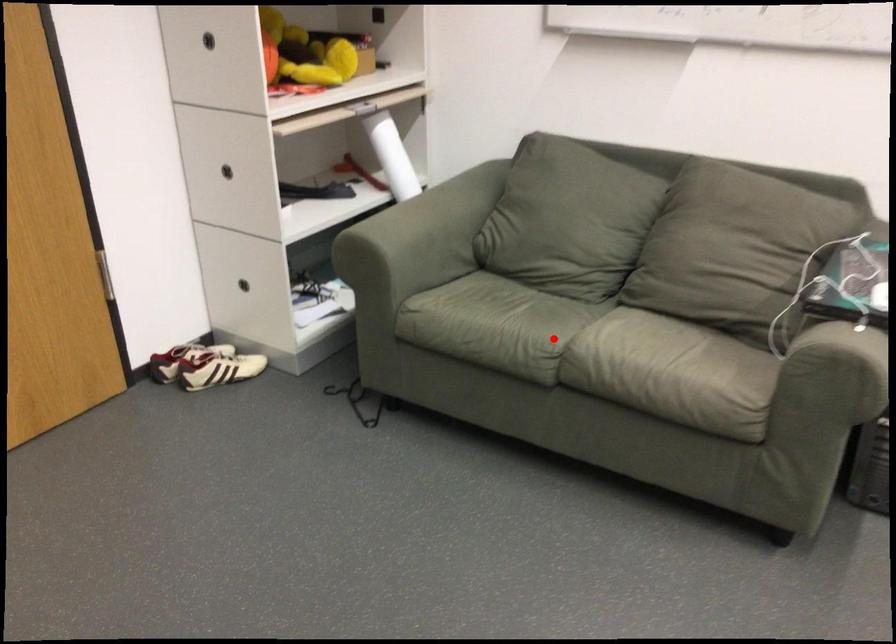
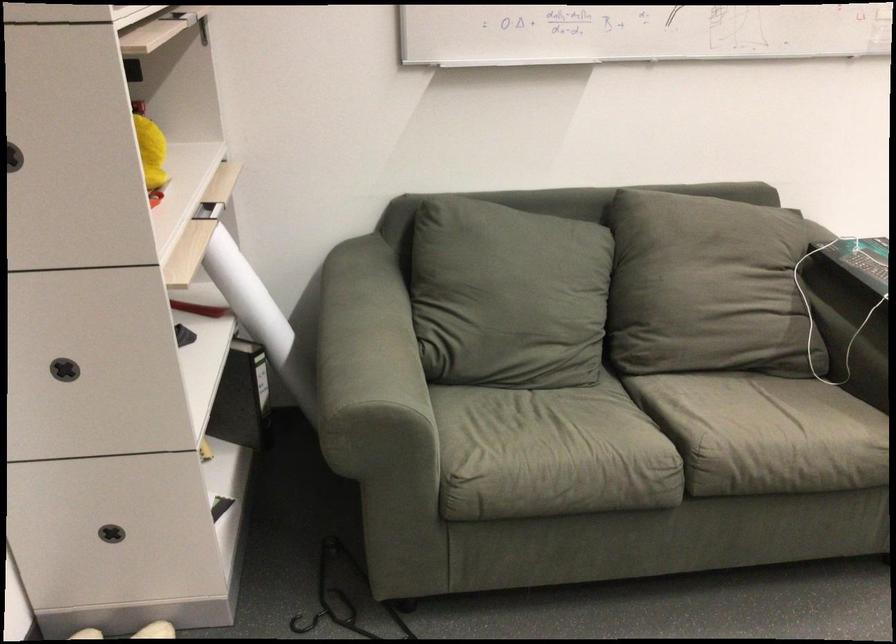
Question: I am providing you with two images of the same scene from different viewpoints. Given a red point in image1, look at the same physical point in image2. Is it:

Choices:
 (A) Closer to the viewpoint
 (B) Farther from the viewpoint

Answer: (A)